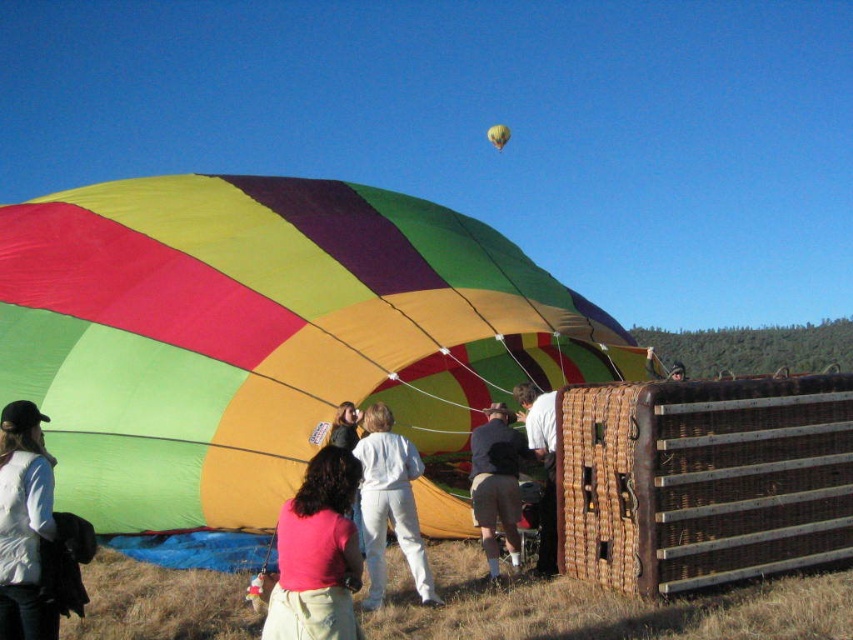
Question: Among these points, which one is nearest to the camera?

Choices:
 (A) (502, 134)
 (B) (339, 433)
 (C) (735, 547)
 (D) (221, 285)

Answer: (C)

Question: Which point is closer to the camera?

Choices:
 (A) (39, 515)
 (B) (502, 132)
 (C) (331, 540)

Answer: (C)

Question: Is multicolored fabric hot air balloon at center thinner than multicolored fabric balloon at upper center?

Choices:
 (A) yes
 (B) no

Answer: (B)

Question: Among these objects, which one is farthest from the camera?

Choices:
 (A) pink fabric shirt at lower center
 (B) dark blue fabric at center
 (C) matte black helmet at center
 (D) multicolored fabric balloon at upper center

Answer: (D)

Question: Can you confirm if woven wicker basket at lower right is bigger than multicolored fabric balloon at upper center?

Choices:
 (A) no
 (B) yes

Answer: (A)

Question: Does woven wicker basket at lower right have a smaller size compared to pink fabric shirt at center?

Choices:
 (A) yes
 (B) no

Answer: (B)